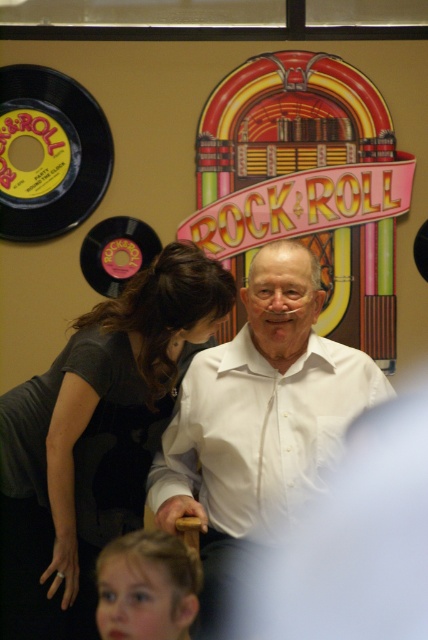
You are a photographer taking a picture of the scene. The dark gray shirt at center and the blonde hair at lower left are both in your camera frame. Which one is positioned higher in the frame?

The dark gray shirt at center is positioned higher in the frame because it is above the blonde hair at lower left.

You are standing in the room and want to place a small plant between the white smooth shirt at center and the blonde hair at lower left. Based on their positions, where should the plant be placed?

The white smooth shirt at center is located above blonde hair at lower left, so the plant should be placed between them in the middle area below the white smooth shirt at center and above the blonde hair at lower left.

In the scene shown: You are a photographer standing in front of the ROCK AND ROLL wall art. You want to take a picture of the two people wearing the dark gray shirt at center and the white smooth shirt at center. If your camera can capture a maximum width of 10 inches, will both shirts fit in the frame?

The distance between the dark gray shirt at center and the white smooth shirt at center is 9.25 inches. Since the camera can capture up to 10 inches, both shirts will fit within the frame as the distance is less than the maximum width.